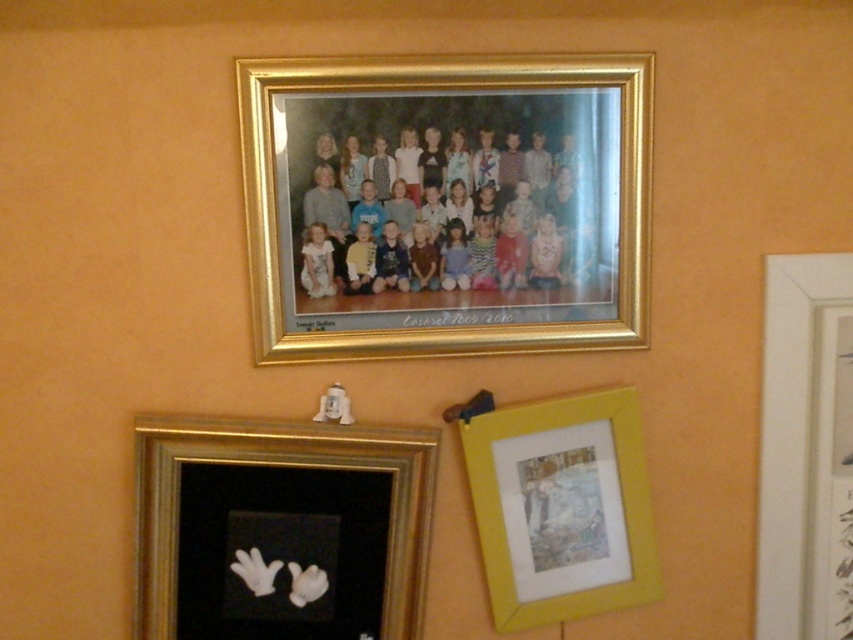
Looking at this image, you are a museum curator who needs to install a new exhibit. You have two items to place on the wall described in the scene. The items are the black velvet gloves at lower left and the white matte picture frame at upper right. The museum requires that all items must be at least 30 inches apart for safety reasons. Based on the current arrangement, will these two items meet the safety requirement?

The distance between the black velvet gloves at lower left and the white matte picture frame at upper right is 26.49 inches, which is less than the required 30 inches. Therefore, these items do not meet the safety requirement and need to be repositioned to ensure proper spacing.

You are looking at the wall with orange paint. There is a gold metallic photo frame at upper center and a yellow matte picture frame at lower right. Which frame is positioned higher on the wall?

The gold metallic photo frame at upper center is positioned higher on the wall than the yellow matte picture frame at lower right.